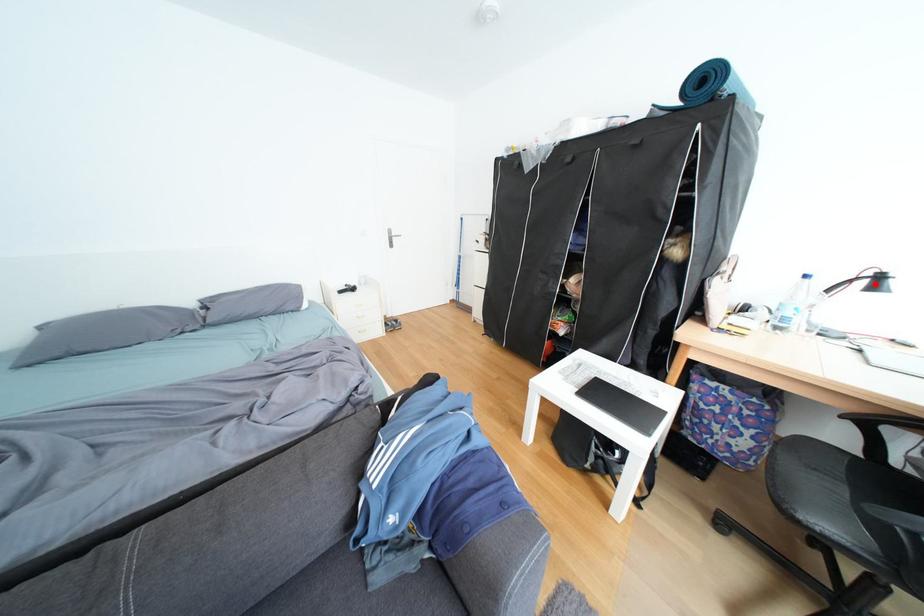
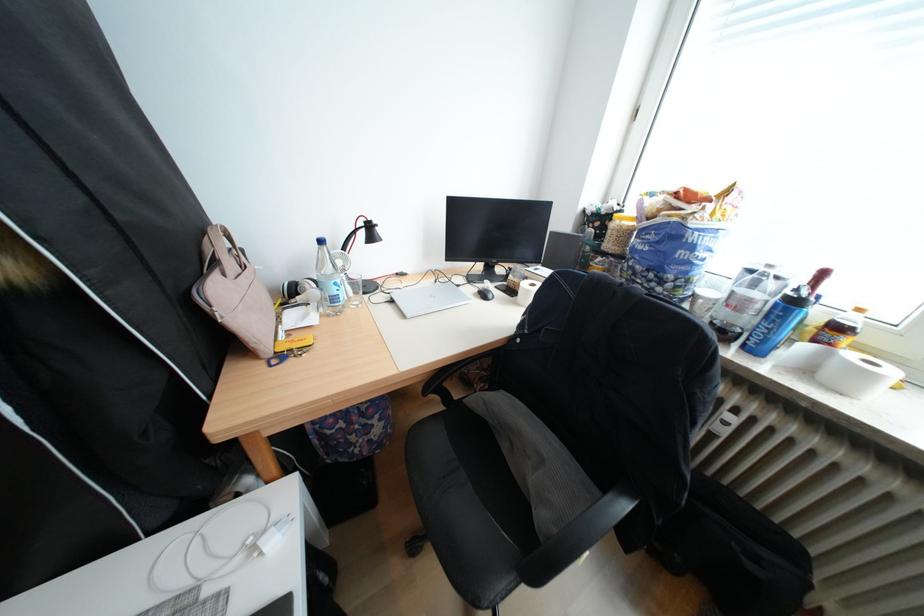
Locate, in the second image, the point that corresponds to the highlighted location in the first image.

(374, 235)